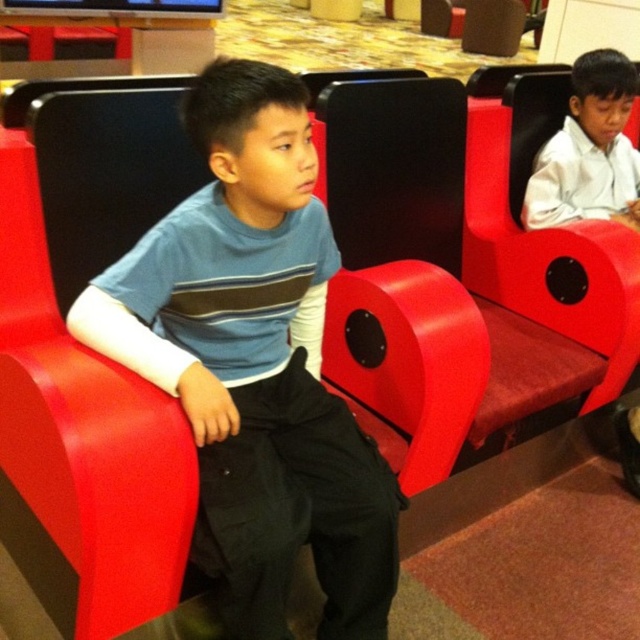
Question: Is matte blue shirt at center above white glossy shirt at upper right?

Choices:
 (A) yes
 (B) no

Answer: (B)

Question: Is matte blue shirt at center to the right of white glossy shirt at upper right from the viewer's perspective?

Choices:
 (A) no
 (B) yes

Answer: (A)

Question: Among these points, which one is nearest to the camera?

Choices:
 (A) (244, 205)
 (B) (609, 51)

Answer: (A)

Question: Which of the following is the farthest from the observer?

Choices:
 (A) white glossy shirt at upper right
 (B) matte blue shirt at center

Answer: (A)

Question: Among these points, which one is farthest from the camera?

Choices:
 (A) (561, 131)
 (B) (253, 374)

Answer: (A)

Question: Is matte blue shirt at center wider than white glossy shirt at upper right?

Choices:
 (A) yes
 (B) no

Answer: (A)